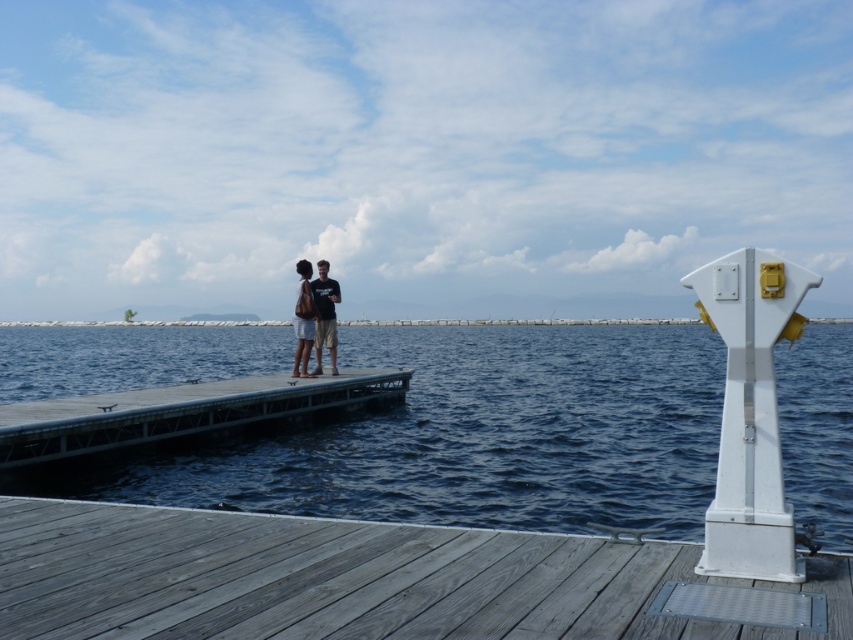
Is blue water at center below gray concrete dock at center?

Actually, blue water at center is above gray concrete dock at center.

Is blue water at center positioned at the back of gray concrete dock at center?

No, blue water at center is closer to the viewer.

The image size is (853, 640). What are the coordinates of `blue water at center` in the screenshot? It's located at (467, 436).

The height and width of the screenshot is (640, 853). Identify the location of blue water at center. (467, 436).

Identify the location of gray wooden dock at lower center. (344, 579).

Who is positioned more to the right, gray wooden dock at lower center or gray concrete dock at center?

gray wooden dock at lower center

Locate an element on the screen. gray wooden dock at lower center is located at coordinates (344, 579).

Who is more forward, [346,508] or [409,605]?

Positioned in front is point [409,605].

Who is more distant from viewer, (488, 349) or (78, 531)?

Point (488, 349)

Is point (827, 461) farther from viewer compared to point (669, 627)?

That is True.

Locate an element on the screen. The height and width of the screenshot is (640, 853). blue water at center is located at coordinates (467, 436).